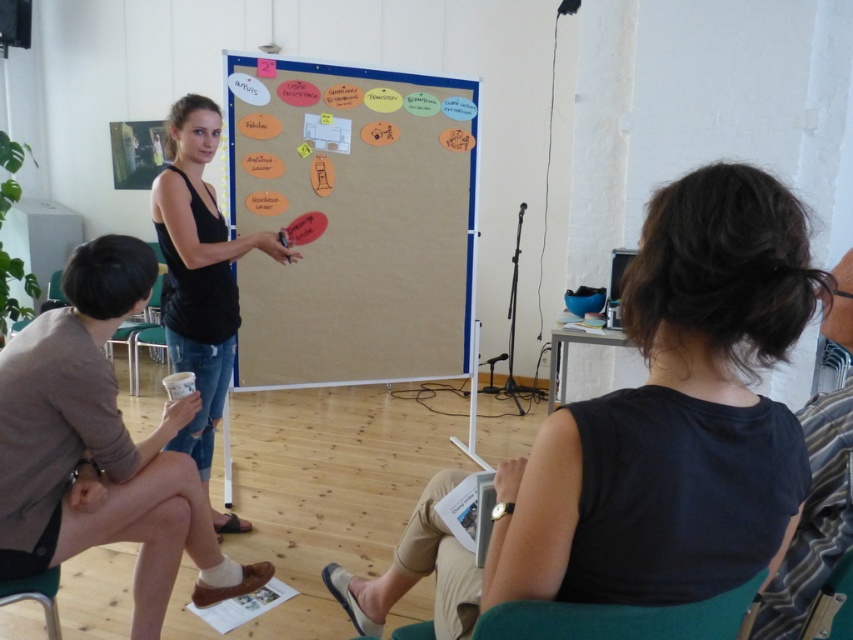
You are standing at the point with coordinates point (663, 620) and want to walk to the point with coordinates point (337, 240). Is there a clear path between them without obstacles?

Point (337, 240) is behind point (663, 620), so there is an obstacle blocking the path between them. You cannot walk directly between them.

In the image of the brainstorming session, there are two people wearing a black fabric shirt at center and a striped fabric shirt at right. Which one is positioned to the left?

The black fabric shirt at center is positioned to the left of the striped fabric shirt at right.